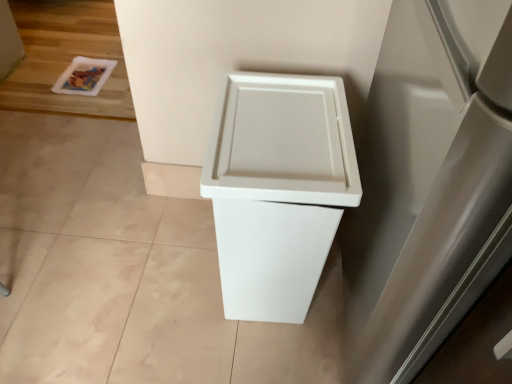
Question: Should I look upward or downward to see white plastic waste bin at center?

Choices:
 (A) up
 (B) down

Answer: (B)